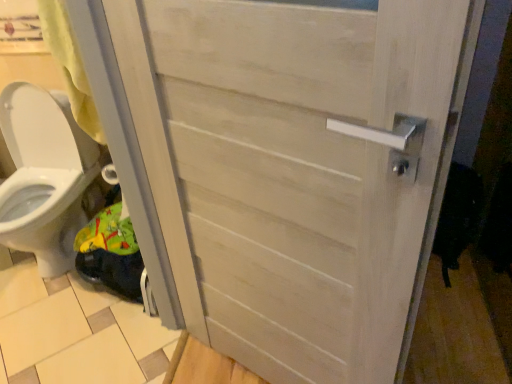
Looking at this image, what is the approximate height of white wood door at center?

white wood door at center is 1.30 meters tall.

I want to click on white wood door at center, so click(298, 168).

Looking at this image, is white glossy toilet at lower left next to white wood door at center?

white glossy toilet at lower left and white wood door at center are clearly separated.

From a real-world perspective, does white glossy toilet at lower left stand above white wood door at center?

Incorrect, from a real-world perspective, white glossy toilet at lower left is lower than white wood door at center.

From the image's perspective, which one is positioned lower, white wood door at center or white glossy toilet at lower left?

white wood door at center appears lower in the image.

Is white wood door at center spatially inside white glossy toilet at lower left, or outside of it?

The correct answer is: outside.

Between white wood door at center and white glossy toilet at lower left, which one appears on the left side from the viewer's perspective?

white glossy toilet at lower left.

Can you confirm if white wood door at center is taller than white glossy toilet at lower left?

Correct, white wood door at center is much taller as white glossy toilet at lower left.

From the image's perspective, is beige wood tile at lower left located above or below white glossy toilet at lower left?

Clearly, from the image's perspective, beige wood tile at lower left is below white glossy toilet at lower left.

From the picture: Is beige wood tile at lower left beside white glossy toilet at lower left?

They are not placed beside each other.

Which object is further away from the camera taking this photo, beige wood tile at lower left or white glossy toilet at lower left?

beige wood tile at lower left is further from the camera.

Considering the relative positions of white wood door at center and beige wood tile at lower left in the image provided, is white wood door at center to the right of beige wood tile at lower left from the viewer's perspective?

Yes, white wood door at center is to the right of beige wood tile at lower left.

Considering their positions, is white wood door at center located in front of or behind beige wood tile at lower left?

Visually, white wood door at center is located in front of beige wood tile at lower left.

What's the angular difference between white wood door at center and beige wood tile at lower left's facing directions?

They differ by 117 degrees in their facing directions.

Is beige wood tile at lower left aimed at white wood door at center?

No, beige wood tile at lower left is not aimed at white wood door at center.

From a real-world perspective, is beige wood tile at lower left positioned above or below white wood door at center?

From a real-world perspective, beige wood tile at lower left is physically below white wood door at center.

Between point (33, 341) and point (419, 89), which one is positioned in front?

Point (419, 89)

Would you consider beige wood tile at lower left to be distant from white wood door at center?

No, beige wood tile at lower left is not far away from white wood door at center.

Which is in front, white glossy toilet at lower left or beige wood tile at lower left?

white glossy toilet at lower left is more forward.

From the image's perspective, who appears lower, white glossy toilet at lower left or beige wood tile at lower left?

beige wood tile at lower left, from the image's perspective.

Is white glossy toilet at lower left shorter than beige wood tile at lower left?

Incorrect, the height of white glossy toilet at lower left does not fall short of that of beige wood tile at lower left.

I want to click on door above the white glossy toilet at lower left (from a real-world perspective), so click(x=298, y=168).

Locate an element on the screen. This screenshot has width=512, height=384. door below the white glossy toilet at lower left (from the image's perspective) is located at coordinates click(298, 168).

From the picture: From the image, which object appears to be nearer to beige wood tile at lower left, white glossy toilet at lower left or white wood door at center?

white glossy toilet at lower left is positioned closer to the anchor beige wood tile at lower left.

Based on their spatial positions, is white wood door at center or beige wood tile at lower left closer to white glossy toilet at lower left?

The object closer to white glossy toilet at lower left is beige wood tile at lower left.

From the image, which object appears to be farther from white glossy toilet at lower left, beige wood tile at lower left or white wood door at center?

white wood door at center lies further to white glossy toilet at lower left than the other object.

Which object lies further to the anchor point beige wood tile at lower left, white wood door at center or white glossy toilet at lower left?

white wood door at center lies further to beige wood tile at lower left than the other object.

When comparing their distances from white wood door at center, does white glossy toilet at lower left or beige wood tile at lower left seem closer?

beige wood tile at lower left is closer to white wood door at center.

Consider the image. Based on their spatial positions, is beige wood tile at lower left or white glossy toilet at lower left closer to white wood door at center?

beige wood tile at lower left.

Where is `toilet located between white wood door at center and beige wood tile at lower left in the depth direction`? This screenshot has width=512, height=384. toilet located between white wood door at center and beige wood tile at lower left in the depth direction is located at coordinates (44, 176).